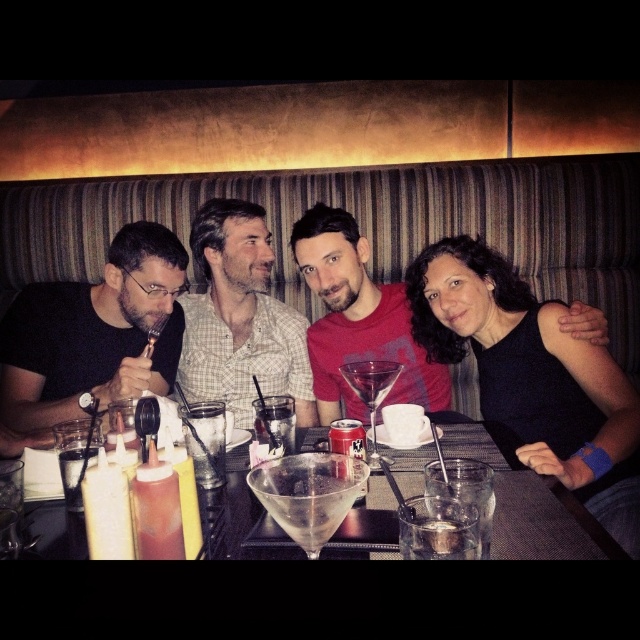
Between point (390, 387) and point (76, 449), which one is positioned in front?

Point (76, 449) is more forward.

Locate an element on the screen. This screenshot has width=640, height=640. transparent glass martini at center is located at coordinates (371, 380).

What are the coordinates of `transparent glass martini at center` in the screenshot? It's located at (371, 380).

Who is positioned more to the left, black matte dress at center or transparent glass martini at center?

transparent glass martini at center is more to the left.

Which of these two, black matte dress at center or transparent glass martini at center, stands shorter?

transparent glass martini at center is shorter.

This screenshot has height=640, width=640. I want to click on black matte dress at center, so click(532, 378).

Can you confirm if checkered fabric shirt at center is positioned above clear glass cup at center?

A: Yes.

Is point (257, 236) positioned behind point (224, 422)?

Yes, it is behind point (224, 422).

This screenshot has height=640, width=640. Describe the element at coordinates (241, 317) in the screenshot. I see `checkered fabric shirt at center` at that location.

This screenshot has height=640, width=640. Identify the location of checkered fabric shirt at center. (241, 317).